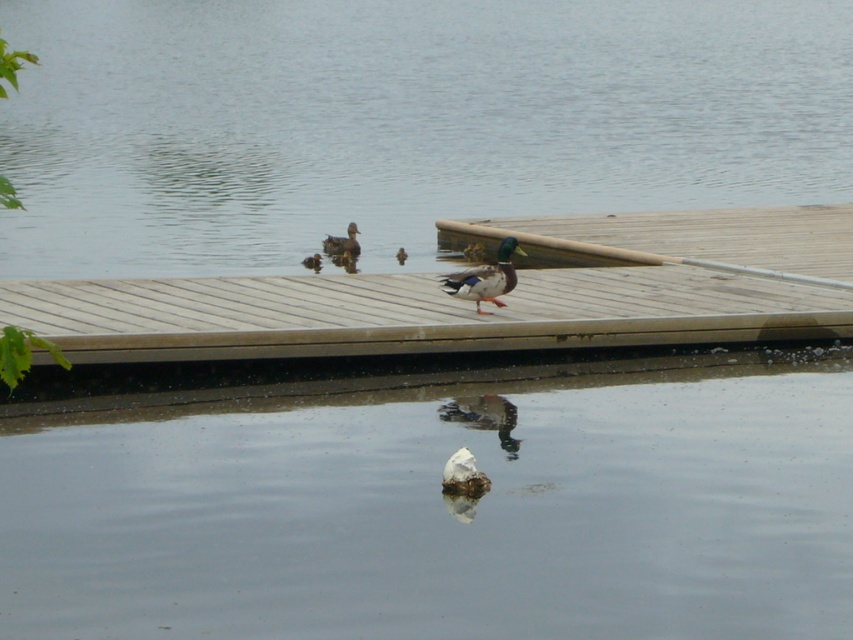
Question: Is smooth water at center above transparent water at dock center?

Choices:
 (A) yes
 (B) no

Answer: (B)

Question: In this image, where is wooden dock at center located relative to shiny green duck at center?

Choices:
 (A) below
 (B) above

Answer: (A)

Question: Which point appears farthest from the camera in this image?

Choices:
 (A) (775, 93)
 (B) (346, 253)
 (C) (204, 330)
 (D) (469, 275)

Answer: (A)

Question: Considering the relative positions of smooth water at center and shiny green duck at center in the image provided, where is smooth water at center located with respect to shiny green duck at center?

Choices:
 (A) below
 (B) above

Answer: (A)

Question: Which object is positioned farthest from the shiny green duck at center?

Choices:
 (A) smooth water at center
 (B) wooden dock at center

Answer: (A)

Question: Among these objects, which one is nearest to the camera?

Choices:
 (A) shiny green duck at center
 (B) transparent water at dock center
 (C) wooden dock at center

Answer: (C)